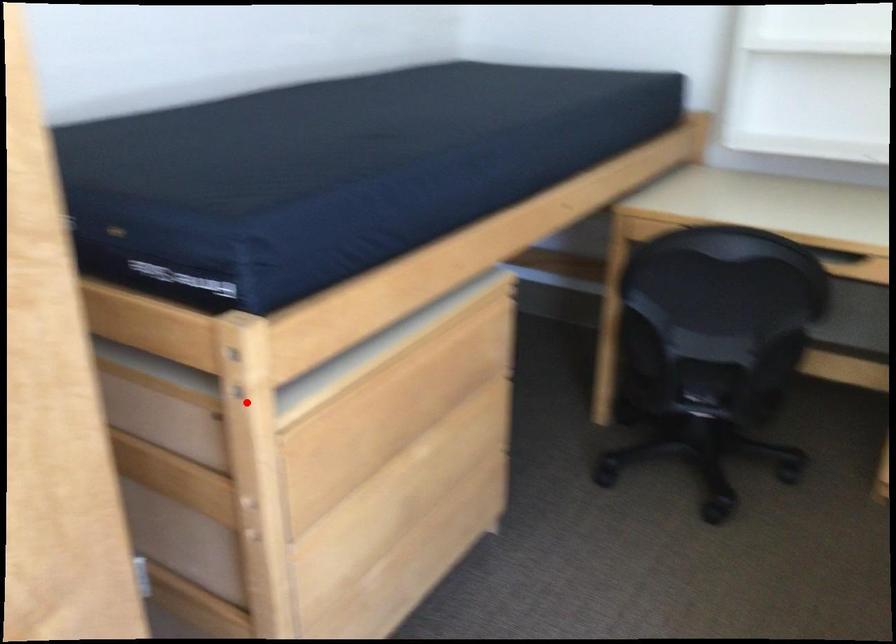
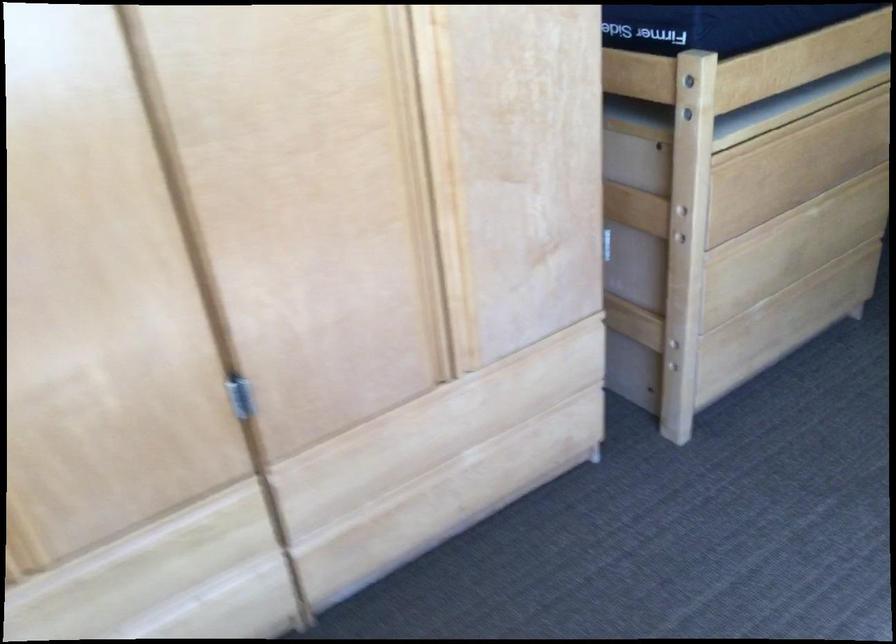
Find the pixel in the second image that matches the highlighted location in the first image.

(688, 116)